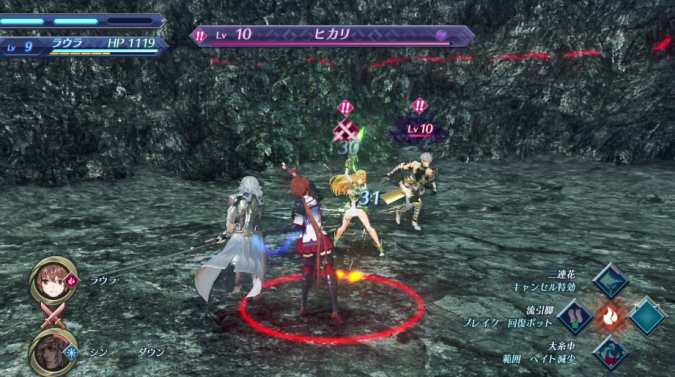
Identify the location of bar. This screenshot has width=675, height=377. (267, 31).